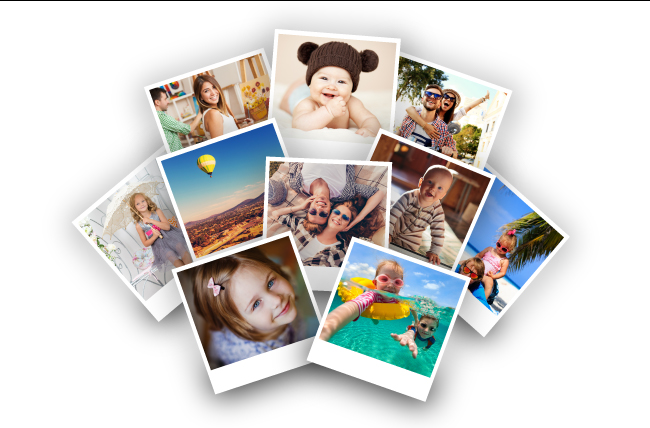
You are a GUI agent. You are given a task and a screenshot of the screen. Output one action in this format:
    pyautogui.click(x=<x>, y=<y>)
    Task: Click on the individual pictures in a collage
    The image size is (650, 428).
    Given the screenshot: What is the action you would take?
    pyautogui.click(x=142, y=252), pyautogui.click(x=255, y=299), pyautogui.click(x=384, y=311), pyautogui.click(x=525, y=264), pyautogui.click(x=416, y=218), pyautogui.click(x=306, y=204), pyautogui.click(x=195, y=190), pyautogui.click(x=199, y=97), pyautogui.click(x=294, y=96), pyautogui.click(x=437, y=98)